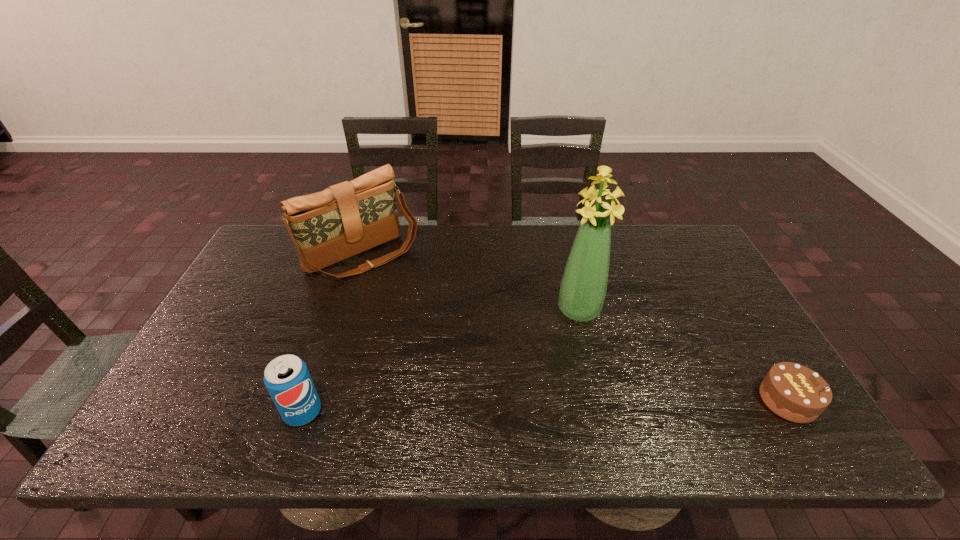
Where is `vacant space that's between the shoulder bag and the tallest object`? The width and height of the screenshot is (960, 540). vacant space that's between the shoulder bag and the tallest object is located at coordinates (470, 283).

Identify the location of free spot between the second shortest object and the second object from right to left. Image resolution: width=960 pixels, height=540 pixels. (441, 361).

At what (x,y) coordinates should I click in order to perform the action: click on unoccupied area between the shortest object and the third tallest object. Please return your answer as a coordinate pair (x, y). This screenshot has width=960, height=540. Looking at the image, I should click on (545, 406).

Locate an element on the screen. empty space between the rightmost object and the third tallest object is located at coordinates (545, 406).

Locate an element on the screen. free space between the soda can and the third nearest object is located at coordinates (441, 361).

Find the location of a particular element. the second closest object to the chocolate cake is located at coordinates (348, 218).

Image resolution: width=960 pixels, height=540 pixels. I want to click on object that stands as the closest to the tallest object, so click(794, 392).

You are a GUI agent. You are given a task and a screenshot of the screen. Output one action in this format:
    pyautogui.click(x=<x>, y=<y>)
    Task: Click on the free space that satisfies the following two spatial constraints: 1. on the front side of the bouquet; 2. on the right side of the farthest object
    Image resolution: width=960 pixels, height=540 pixels.
    Given the screenshot: What is the action you would take?
    pyautogui.click(x=345, y=310)

Where is `free location that satisfies the following two spatial constraints: 1. on the front side of the bouquet; 2. on the right side of the rightmost object`? The height and width of the screenshot is (540, 960). free location that satisfies the following two spatial constraints: 1. on the front side of the bouquet; 2. on the right side of the rightmost object is located at coordinates (600, 400).

The image size is (960, 540). What are the coordinates of `vacant space that satisfies the following two spatial constraints: 1. on the front side of the tallest object; 2. on the right side of the shoulder bag` in the screenshot? It's located at (345, 310).